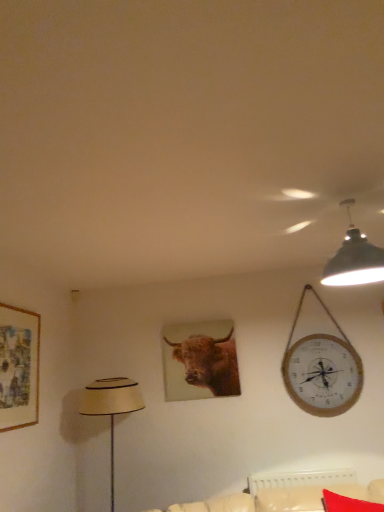
Question: Does red fabric pillow at lower right have a lesser width compared to matte beige lampshade at left?

Choices:
 (A) no
 (B) yes

Answer: (A)

Question: From a real-world perspective, is red fabric pillow at lower right positioned under matte beige lampshade at left based on gravity?

Choices:
 (A) no
 (B) yes

Answer: (B)

Question: From the image's perspective, would you say red fabric pillow at lower right is positioned over matte beige lampshade at left?

Choices:
 (A) yes
 (B) no

Answer: (B)

Question: Is red fabric pillow at lower right smaller than matte beige lampshade at left?

Choices:
 (A) no
 (B) yes

Answer: (B)

Question: Considering the relative positions of red fabric pillow at lower right and matte beige lampshade at left in the image provided, is red fabric pillow at lower right to the right of matte beige lampshade at left from the viewer's perspective?

Choices:
 (A) yes
 (B) no

Answer: (A)

Question: From the image's perspective, is matte beige lampshade at left positioned above or below black matte lampshade at upper right?

Choices:
 (A) above
 (B) below

Answer: (B)

Question: Is matte beige lampshade at left taller or shorter than black matte lampshade at upper right?

Choices:
 (A) tall
 (B) short

Answer: (A)

Question: Which is correct: matte beige lampshade at left is inside black matte lampshade at upper right, or outside of it?

Choices:
 (A) outside
 (B) inside

Answer: (A)

Question: Is matte beige lampshade at left wider or thinner than black matte lampshade at upper right?

Choices:
 (A) wide
 (B) thin

Answer: (A)

Question: Is wooden picture frame at left in front of or behind matte beige lampshade at left in the image?

Choices:
 (A) front
 (B) behind

Answer: (A)

Question: Is point (16, 409) positioned closer to the camera than point (112, 393)?

Choices:
 (A) farther
 (B) closer

Answer: (B)

Question: Based on their sizes in the image, would you say wooden picture frame at left is bigger or smaller than matte beige lampshade at left?

Choices:
 (A) big
 (B) small

Answer: (B)

Question: From a real-world perspective, is wooden picture frame at left positioned above or below matte beige lampshade at left?

Choices:
 (A) below
 (B) above

Answer: (B)

Question: Would you say wooden picture frame at left is to the left or to the right of red fabric pillow at lower right in the picture?

Choices:
 (A) right
 (B) left

Answer: (B)

Question: From their relative heights in the image, would you say wooden picture frame at left is taller or shorter than red fabric pillow at lower right?

Choices:
 (A) short
 (B) tall

Answer: (B)